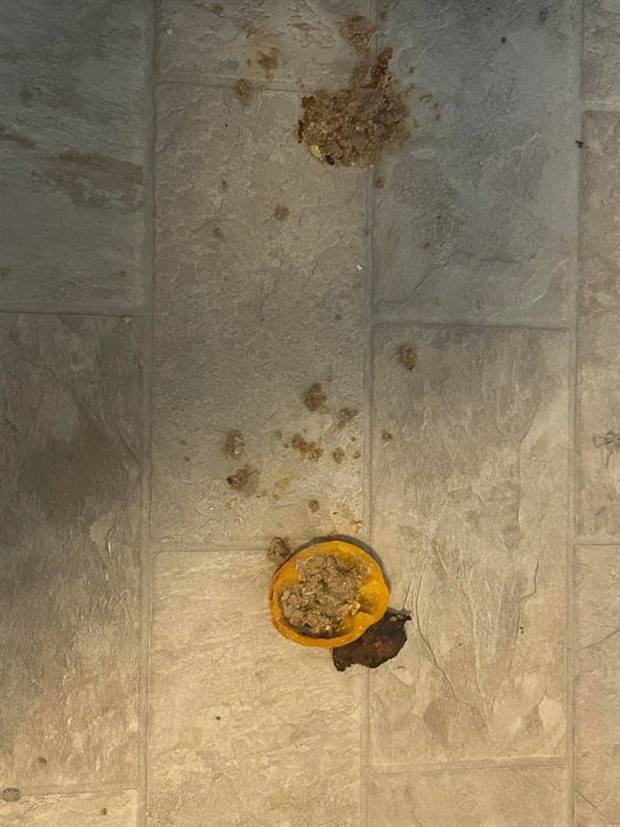
Where is `tile`? tile is located at coordinates (480, 240).